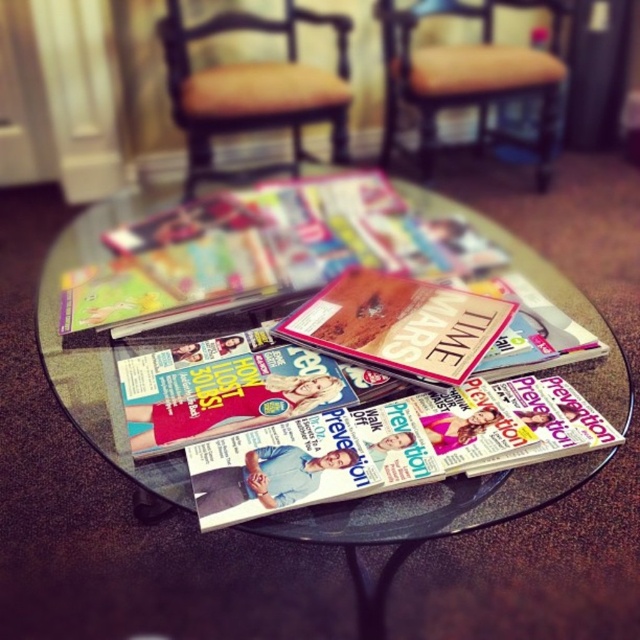
Question: Can you confirm if clear glass table at center is positioned below brown fabric armchair at upper center?

Choices:
 (A) yes
 (B) no

Answer: (A)

Question: Where is matte paper prevention magazine at center located in relation to brown fabric armchair at upper center in the image?

Choices:
 (A) left
 (B) right

Answer: (A)

Question: Is the position of clear glass table at center more distant than that of brown fabric armchair at center?

Choices:
 (A) yes
 (B) no

Answer: (B)

Question: Which of the following is the farthest from the observer?

Choices:
 (A) (493, 422)
 (B) (468, 304)
 (C) (275, 166)

Answer: (C)

Question: Which is nearer to the clear glass table at center?

Choices:
 (A) matte paper magazine at center
 (B) brown fabric armchair at upper center
 (C) brown fabric armchair at center
 (D) matte paper prevention magazine at center

Answer: (D)

Question: Which of these objects is positioned closest to the matte paper prevention magazine at center?

Choices:
 (A) brown fabric armchair at center
 (B) matte paper magazine at center
 (C) clear glass table at center
 (D) brown fabric armchair at upper center

Answer: (C)